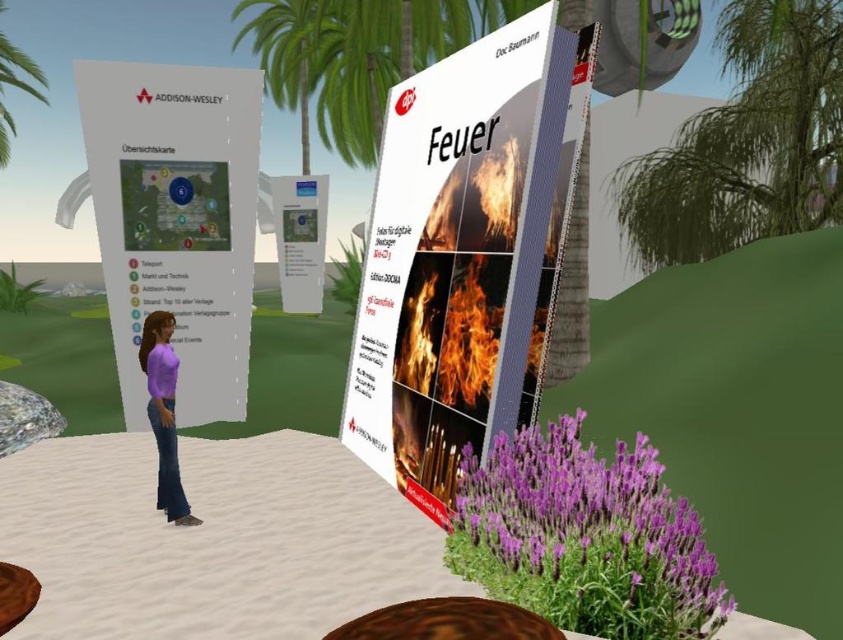
Question: Is rustic wood stool at lower center to the left of green leafy palm tree at upper left from the viewer's perspective?

Choices:
 (A) no
 (B) yes

Answer: (A)

Question: Among these points, which one is farthest from the camera?

Choices:
 (A) (438, 339)
 (B) (167, 442)
 (C) (176, 260)
 (D) (427, 611)

Answer: (B)

Question: Is white glossy sign at center smaller than green leafy palm tree at upper left?

Choices:
 (A) no
 (B) yes

Answer: (B)

Question: Estimate the real-world distances between objects in this image. Which object is closer to the white glossy book at center?

Choices:
 (A) green leafy palm tree at upper left
 (B) white paper map at left

Answer: (B)

Question: Among these objects, which one is farthest from the camera?

Choices:
 (A) white paper map at left
 (B) matte purple shirt at center

Answer: (B)

Question: Does white glossy sign at center appear under green leafy palm tree at upper left?

Choices:
 (A) no
 (B) yes

Answer: (B)